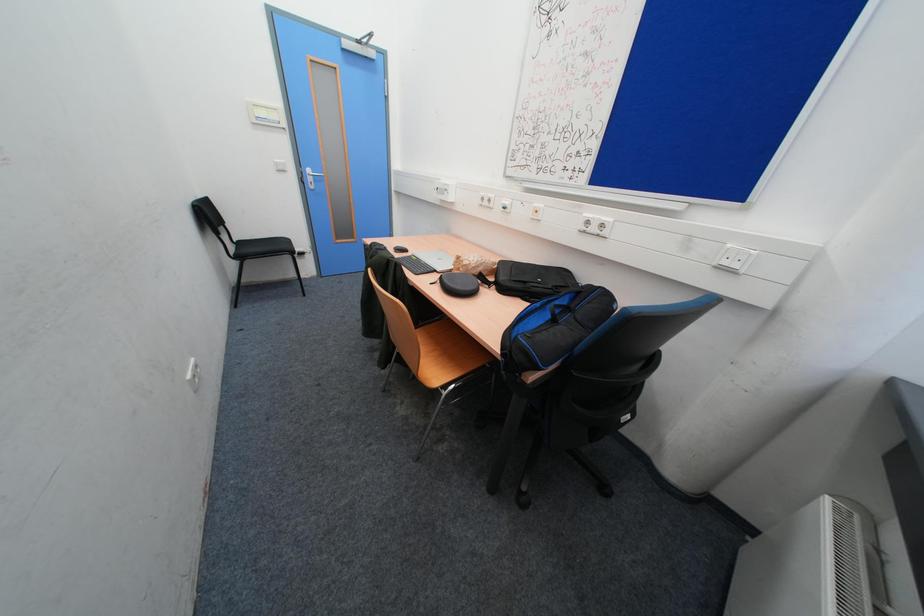
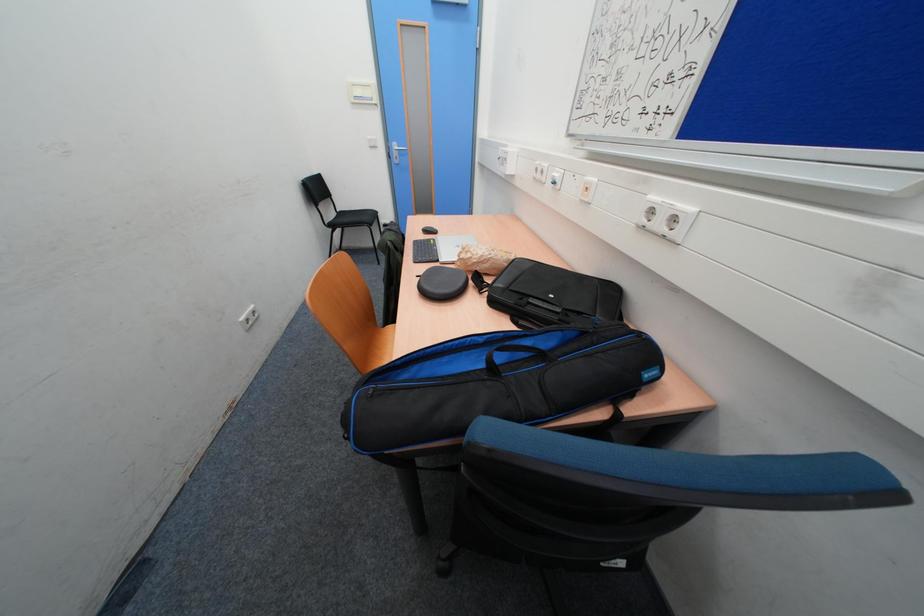
In a continuous first-person perspective shot, in which direction is the camera moving?

The movement direction of the cameraman is right, forward.